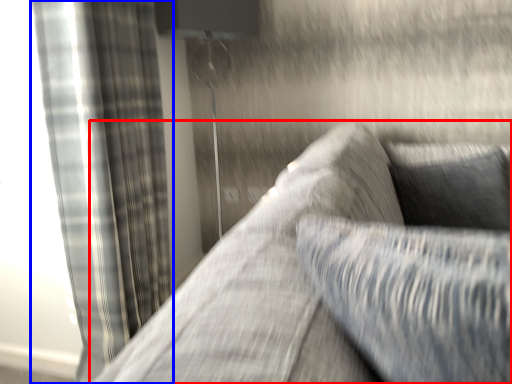
Question: Among these objects, which one is nearest to the camera, studio couch (highlighted by a red box) or curtain (highlighted by a blue box)?

Choices:
 (A) studio couch
 (B) curtain

Answer: (A)